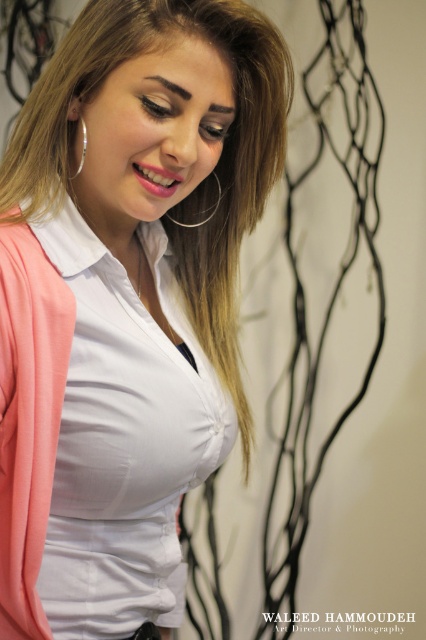
Is white matte shirt at center closer to camera compared to silver metallic hoop at upper left?

Yes.

Consider the image. Who is shorter, white matte shirt at center or silver metallic hoop at upper left?

Standing shorter between the two is silver metallic hoop at upper left.

Locate an element on the screen. Image resolution: width=426 pixels, height=640 pixels. white matte shirt at center is located at coordinates (126, 301).